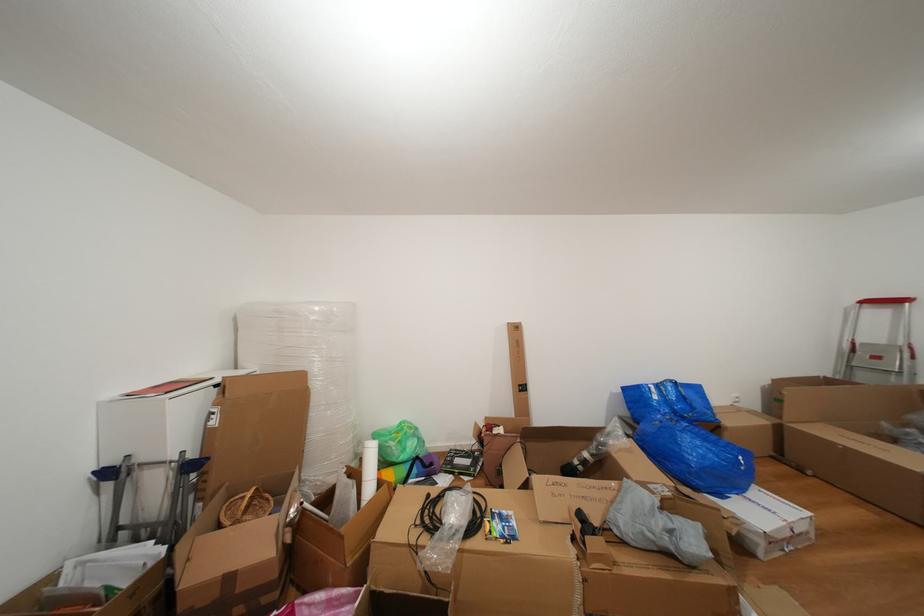
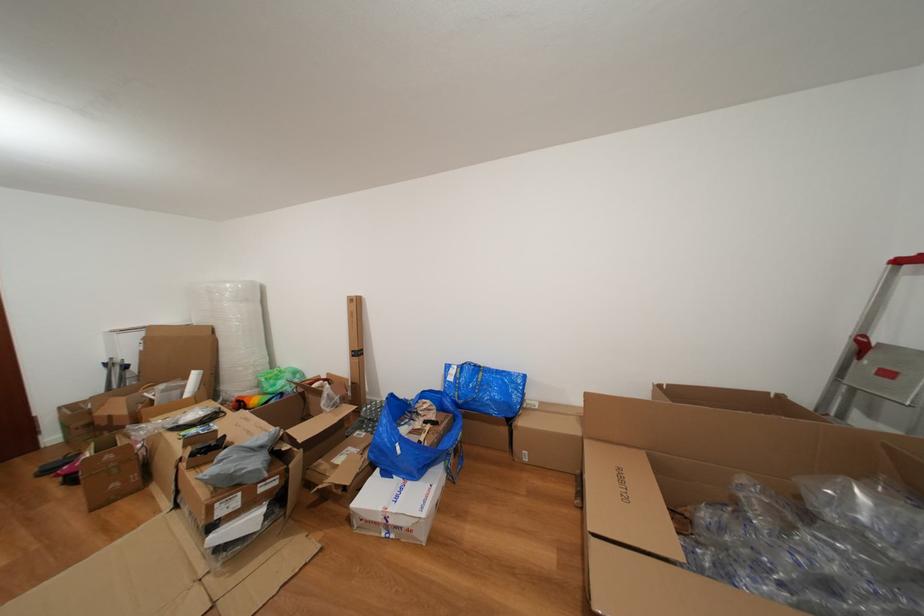
Question: The images are taken continuously from a first-person perspective. In which direction are you moving?

Choices:
 (A) Left
 (B) Right
 (C) Forward
 (D) Backward

Answer: (B)